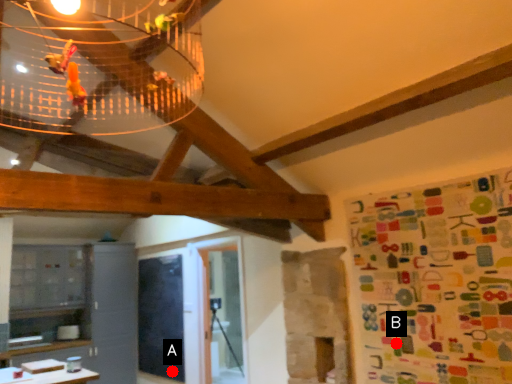
Question: Two points are circled on the image, labeled by A and B beside each circle. Which point is further to the camera?

Choices:
 (A) A is further
 (B) B is further

Answer: (A)